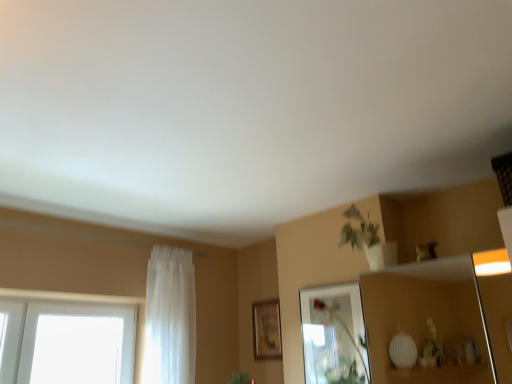
The image size is (512, 384). Describe the element at coordinates (333, 335) in the screenshot. I see `clear glass mirror at upper center` at that location.

Find the location of `wooden picture frame at center`. wooden picture frame at center is located at coordinates (266, 329).

What do you see at coordinates (266, 329) in the screenshot?
I see `wooden picture frame at center` at bounding box center [266, 329].

Locate an element on the screen. Image resolution: width=512 pixels, height=384 pixels. clear glass mirror at upper center is located at coordinates (333, 335).

Locate an element on the screen. The height and width of the screenshot is (384, 512). curtain located behind the clear glass mirror at upper center is located at coordinates (170, 317).

From a real-world perspective, who is located higher, white sheer curtain at left or clear glass mirror at upper center?

From a 3D spatial view, white sheer curtain at left is above.

Is white sheer curtain at left positioned in front of clear glass mirror at upper center?

That is False.

From the image's perspective, is white sheer curtain at left above clear glass mirror at upper center?

Indeed, from the image's perspective, white sheer curtain at left is shown above clear glass mirror at upper center.

Does clear glass mirror at upper center have a greater height compared to white sheer curtain at left?

No, clear glass mirror at upper center is not taller than white sheer curtain at left.

How much distance is there between clear glass mirror at upper center and white sheer curtain at left?

The distance of clear glass mirror at upper center from white sheer curtain at left is 91.68 centimeters.

Would you say clear glass mirror at upper center is inside or outside white sheer curtain at left?

clear glass mirror at upper center is spatially situated outside white sheer curtain at left.

Considering the relative positions of clear glass mirror at upper center and white sheer curtain at left in the image provided, is clear glass mirror at upper center to the left of white sheer curtain at left from the viewer's perspective?

Incorrect, clear glass mirror at upper center is not on the left side of white sheer curtain at left.

How different are the orientations of clear glass mirror at upper center and wooden picture frame at center in degrees?

The angle between the facing direction of clear glass mirror at upper center and the facing direction of wooden picture frame at center is 0.839 degrees.

From a real-world perspective, is clear glass mirror at upper center below wooden picture frame at center?

Yes, from a real-world perspective, clear glass mirror at upper center is beneath wooden picture frame at center.

Is clear glass mirror at upper center far from wooden picture frame at center?

No.

Between clear glass mirror at upper center and wooden picture frame at center, which one appears on the right side from the viewer's perspective?

Positioned to the right is clear glass mirror at upper center.

The image size is (512, 384). Find the location of `picture frame below the clear glass mirror at upper center (from the image's perspective)`. picture frame below the clear glass mirror at upper center (from the image's perspective) is located at coordinates (266, 329).

Relative to clear glass mirror at upper center, is wooden picture frame at center in front or behind?

wooden picture frame at center is positioned farther from the viewer than clear glass mirror at upper center.

Considering the sizes of objects wooden picture frame at center and clear glass mirror at upper center in the image provided, who is shorter, wooden picture frame at center or clear glass mirror at upper center?

With less height is wooden picture frame at center.

Between point (265, 347) and point (325, 337), which one is positioned behind?

Point (265, 347)

Measure the distance between white sheer curtain at left and wooden picture frame at center.

67.42 centimeters.

Which of these two, white sheer curtain at left or wooden picture frame at center, is thinner?

wooden picture frame at center is thinner.

From the image's perspective, is white sheer curtain at left above wooden picture frame at center?

Yes, from the image's perspective, white sheer curtain at left is on top of wooden picture frame at center.

Considering the sizes of white sheer curtain at left and wooden picture frame at center in the image, is white sheer curtain at left bigger or smaller than wooden picture frame at center?

white sheer curtain at left is bigger than wooden picture frame at center.

From a real-world perspective, relative to white sheer curtain at left, is wooden picture frame at center vertically above or below?

In terms of real-world spatial position, wooden picture frame at center is below white sheer curtain at left.

Between wooden picture frame at center and white sheer curtain at left, which one appears on the left side from the viewer's perspective?

Positioned to the left is white sheer curtain at left.

How many degrees apart are the facing directions of wooden picture frame at center and white sheer curtain at left?

The facing directions of wooden picture frame at center and white sheer curtain at left are 90 degrees apart.

Is white sheer curtain at left surrounded by wooden picture frame at center?

No, wooden picture frame at center does not contain white sheer curtain at left.

At what (x,y) coordinates should I click in order to perform the action: click on mirror below the white sheer curtain at left (from a real-world perspective). Please return your answer as a coordinate pair (x, y). Looking at the image, I should click on (333, 335).

Identify the location of curtain above the clear glass mirror at upper center (from a real-world perspective). This screenshot has width=512, height=384. (170, 317).

Estimate the real-world distances between objects in this image. Which object is closer to wooden picture frame at center, clear glass mirror at upper center or white sheer curtain at left?

clear glass mirror at upper center.

Estimate the real-world distances between objects in this image. Which object is closer to clear glass mirror at upper center, wooden picture frame at center or white sheer curtain at left?

wooden picture frame at center is closer to clear glass mirror at upper center.

Which object lies further to the anchor point wooden picture frame at center, white sheer curtain at left or clear glass mirror at upper center?

white sheer curtain at left lies further to wooden picture frame at center than the other object.

Considering their positions, is wooden picture frame at center positioned closer to white sheer curtain at left than clear glass mirror at upper center?

wooden picture frame at center is positioned closer to the anchor white sheer curtain at left.

Based on their spatial positions, is clear glass mirror at upper center or wooden picture frame at center closer to white sheer curtain at left?

wooden picture frame at center is closer to white sheer curtain at left.

When comparing their distances from clear glass mirror at upper center, does white sheer curtain at left or wooden picture frame at center seem further?

The object further to clear glass mirror at upper center is white sheer curtain at left.

What are the coordinates of `picture frame between white sheer curtain at left and clear glass mirror at upper center` in the screenshot? It's located at (266, 329).